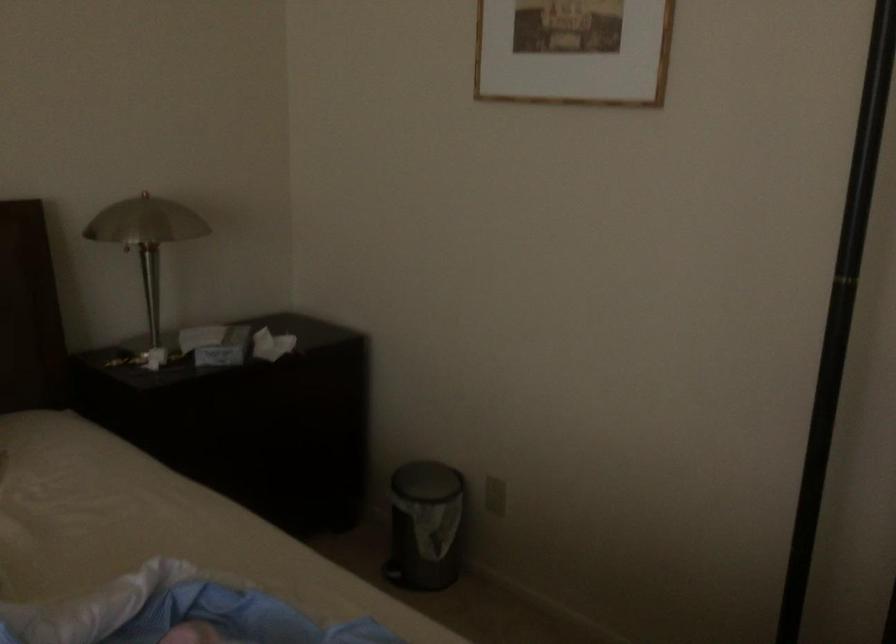
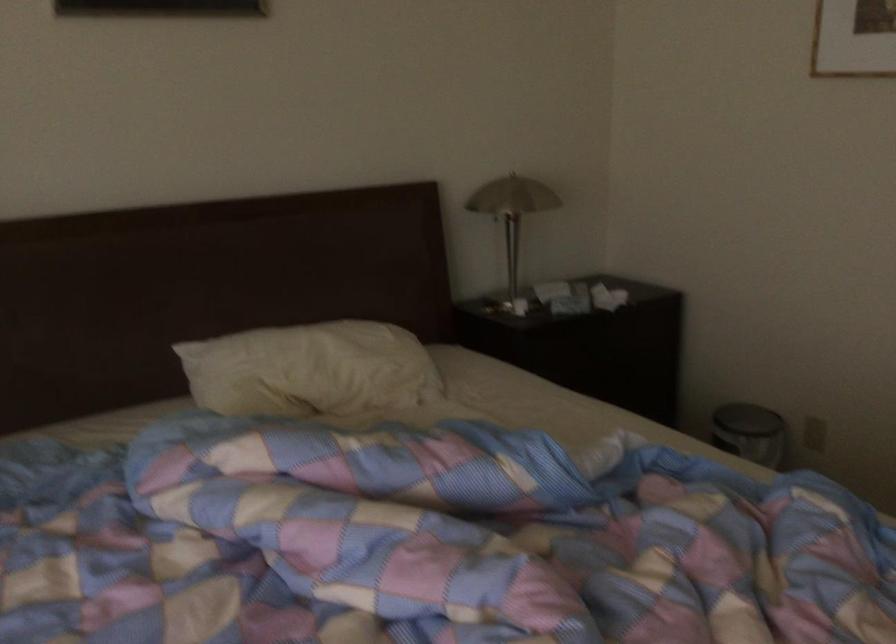
In the second image, find the point that corresponds to [147,247] in the first image.

(512, 213)